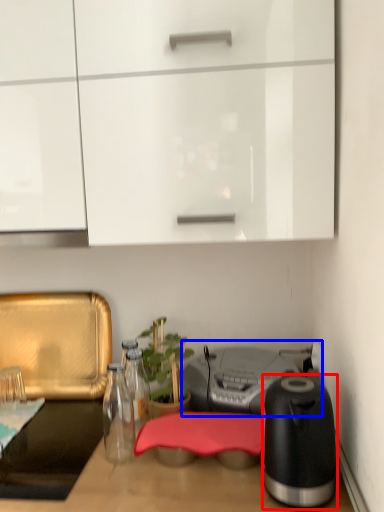
Question: Which of the following is the closest to the observer, kitchen appliance (highlighted by a red box) or appliance (highlighted by a blue box)?

Choices:
 (A) kitchen appliance
 (B) appliance

Answer: (A)